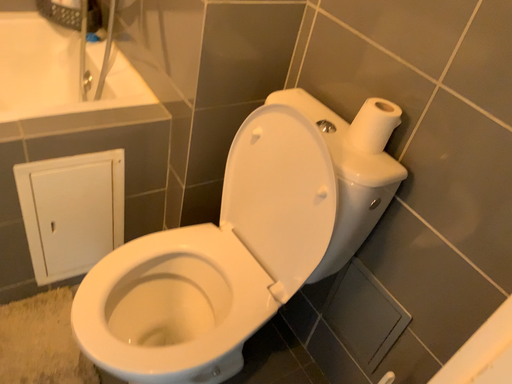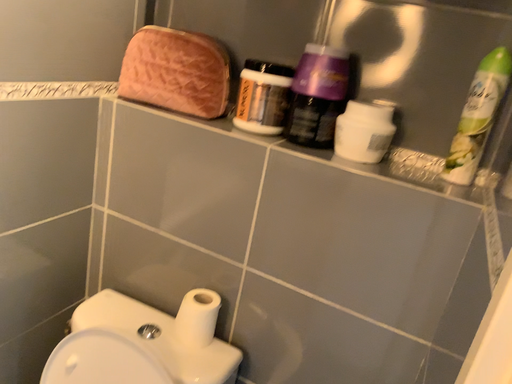
Question: Which way did the camera rotate in the video?

Choices:
 (A) rotated right
 (B) rotated left

Answer: (A)